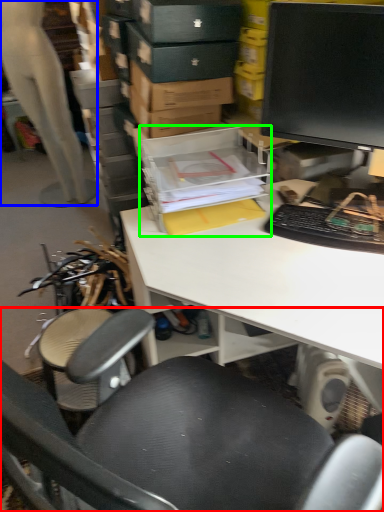
Question: Which object is positioned farthest from chair (highlighted by a red box)? Select from person (highlighted by a blue box) and storage box (highlighted by a green box).

Choices:
 (A) person
 (B) storage box

Answer: (A)